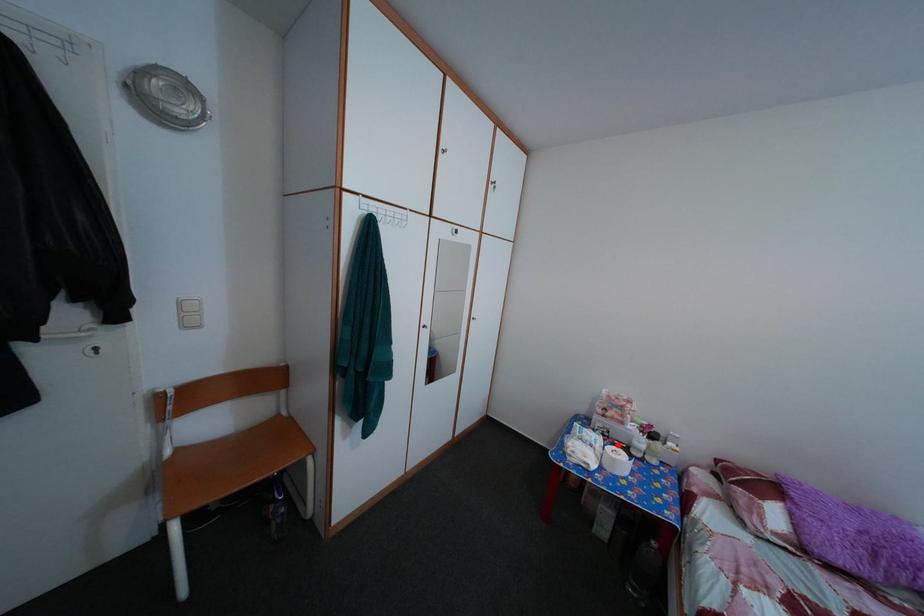
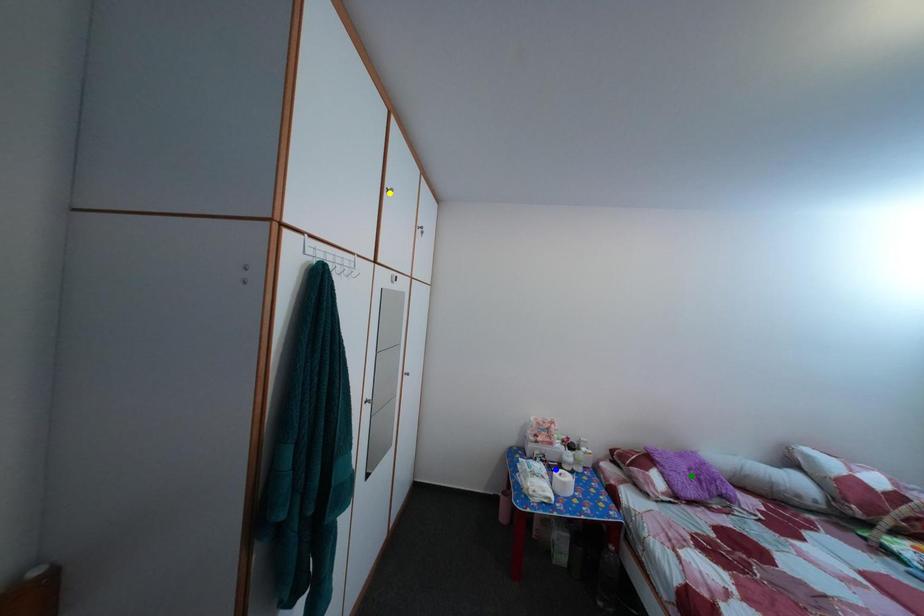
Question: I am providing you with two images of the same scene from different viewpoints. A red point is marked on the first image. You are given multiple points on the second image. Which spot in image 2 lines up with the point in image 1?

Choices:
 (A) yellow point
 (B) green point
 (C) blue point

Answer: (C)